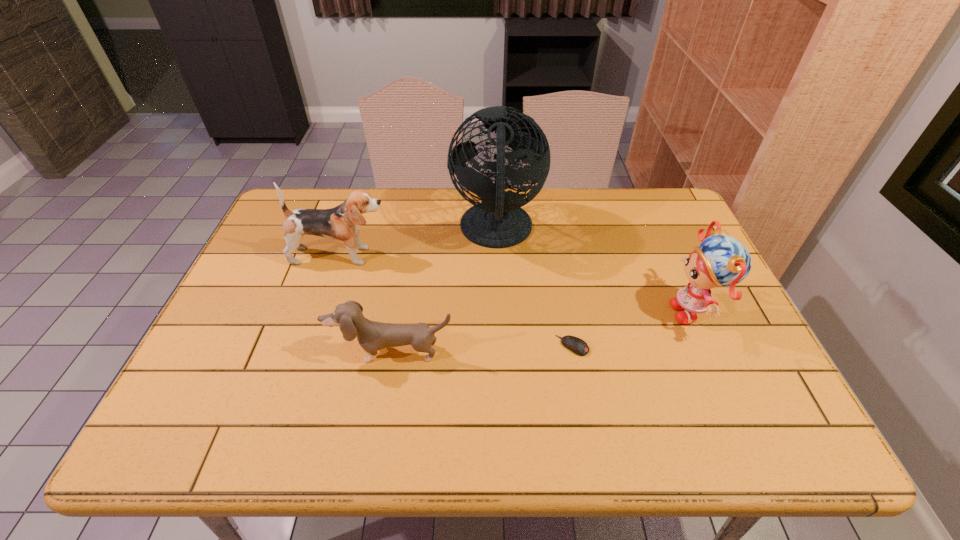
Find the location of `vacant point located on the face of the rightmost object`. vacant point located on the face of the rightmost object is located at coordinates (522, 312).

This screenshot has height=540, width=960. In order to click on vacant space located 0.100m on the face of the rightmost object in this screenshot , I will do `click(629, 312)`.

Locate an element on the screen. The height and width of the screenshot is (540, 960). vacant region located on the face of the rightmost object is located at coordinates (518, 312).

The height and width of the screenshot is (540, 960). I want to click on vacant area situated at the face of the nearer puppy, so click(x=381, y=418).

Identify the location of free region located on the back of the computer mouse. This screenshot has height=540, width=960. (559, 268).

Locate an element on the screen. object present at the far edge is located at coordinates 498,221.

Where is `object present at the left edge`? The width and height of the screenshot is (960, 540). object present at the left edge is located at coordinates (342, 222).

The height and width of the screenshot is (540, 960). In order to click on object located at the right edge in this screenshot , I will do `click(720, 261)`.

You are a GUI agent. You are given a task and a screenshot of the screen. Output one action in this format:
    pyautogui.click(x=<x>, y=<y>)
    Task: Click on the free space at the far edge of the desktop
    The height and width of the screenshot is (540, 960).
    Given the screenshot: What is the action you would take?
    pyautogui.click(x=564, y=205)

Locate an element on the screen. free space at the near edge of the desktop is located at coordinates (261, 429).